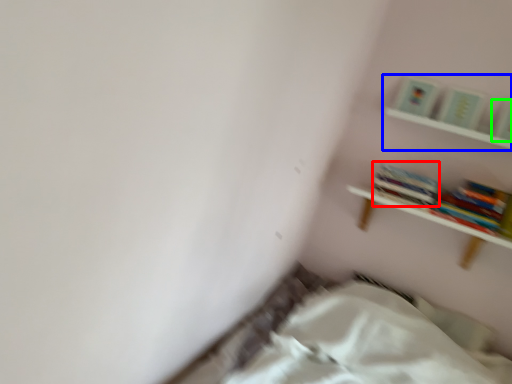
Question: Based on their relative distances, which object is farther from book (highlighted by a red box)? Choose from shelf (highlighted by a blue box) and paperback book (highlighted by a green box).

Choices:
 (A) shelf
 (B) paperback book

Answer: (B)